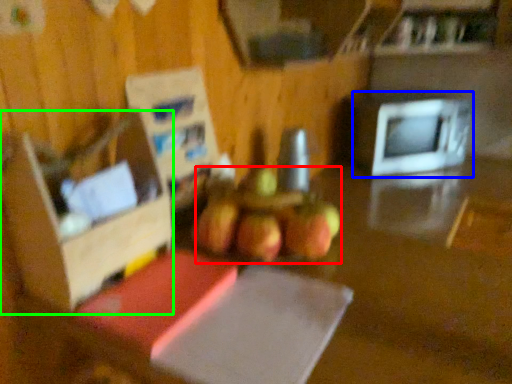
Question: Which is farther away from apple (highlighted by a red box)? microwave oven (highlighted by a blue box) or box (highlighted by a green box)?

Choices:
 (A) microwave oven
 (B) box

Answer: (A)